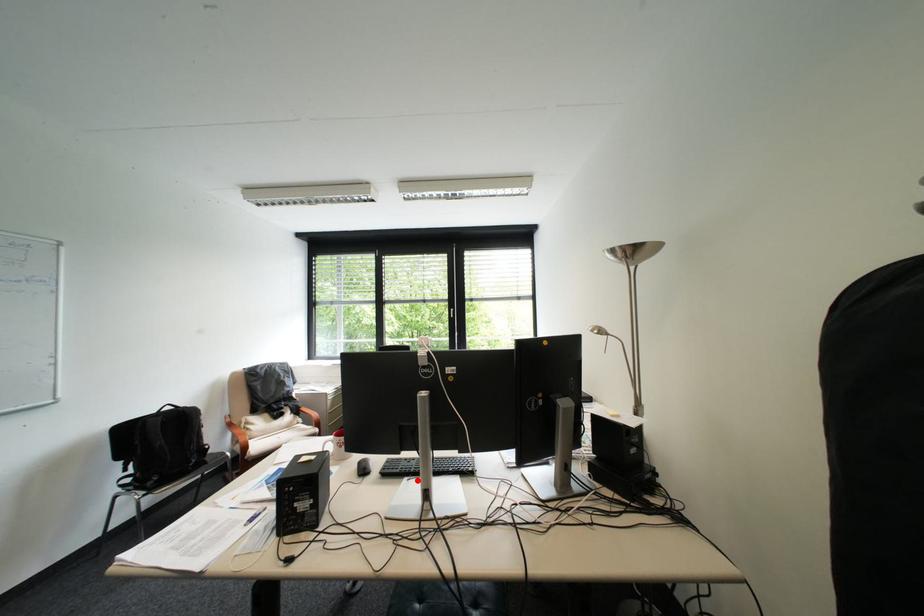
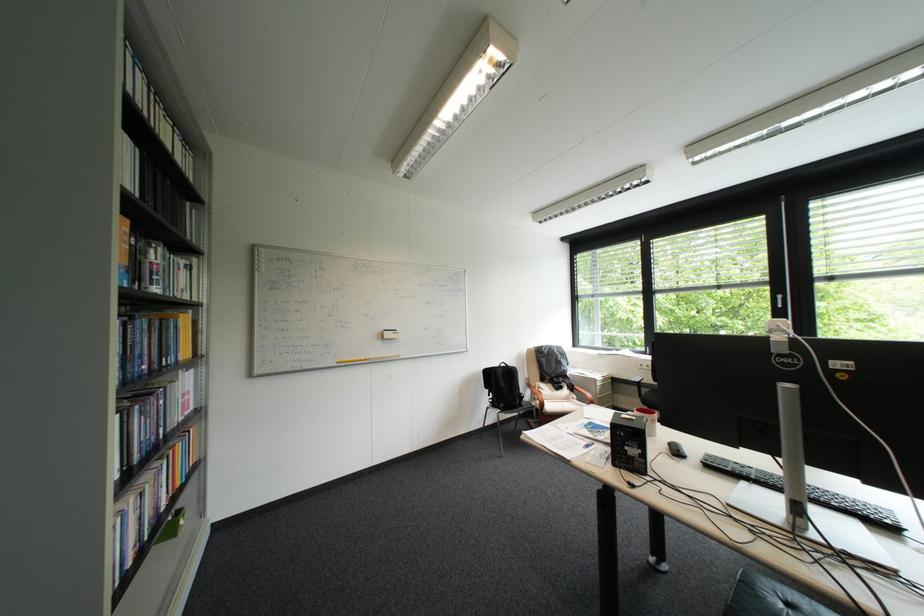
Question: I am providing you with two images of the same scene from different viewpoints. A red point is shown in image1. For the corresponding object point in image2, is it positioned nearer or farther from the camera?

Choices:
 (A) Nearer
 (B) Farther

Answer: (A)